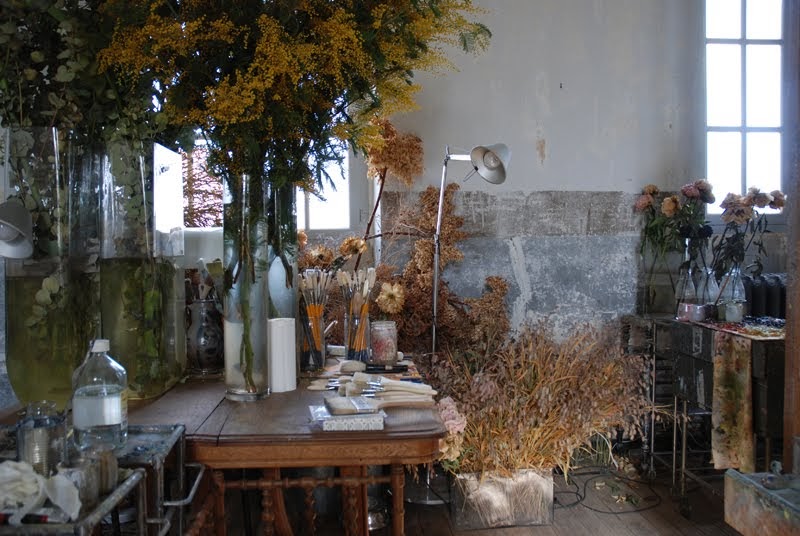
The height and width of the screenshot is (536, 800). In order to click on wall in this screenshot , I will do `click(550, 101)`, `click(574, 240)`.